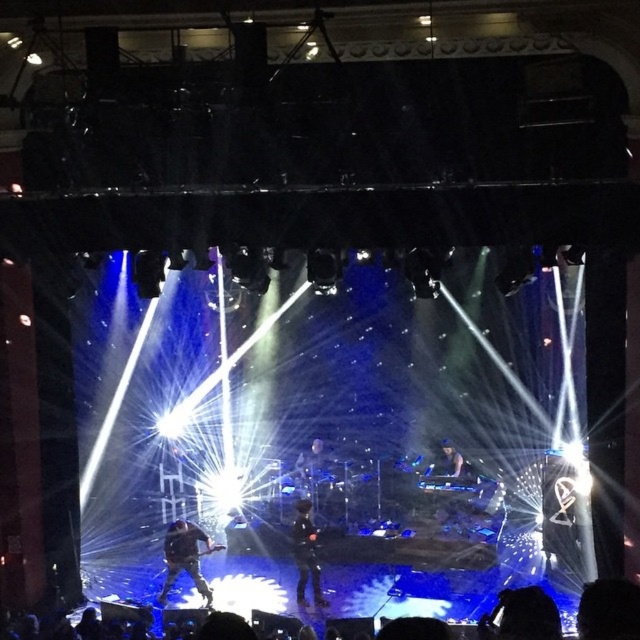
Question: Observing the image, what is the correct spatial positioning of black leather jacket at center in reference to black matte jacket at center?

Choices:
 (A) above
 (B) below

Answer: (B)

Question: Can you confirm if black leather jacket at center is positioned above black matte jacket at center?

Choices:
 (A) no
 (B) yes

Answer: (A)

Question: Is black leather jacket at center thinner than black matte jacket at center?

Choices:
 (A) yes
 (B) no

Answer: (B)

Question: Which point is farther to the camera?

Choices:
 (A) black matte jacket at center
 (B) black leather jacket at center

Answer: (A)

Question: Among these objects, which one is nearest to the camera?

Choices:
 (A) black matte jacket at center
 (B) black leather jacket at center

Answer: (B)

Question: Which point is closer to the camera?

Choices:
 (A) black matte jacket at center
 (B) black leather jacket at center

Answer: (B)